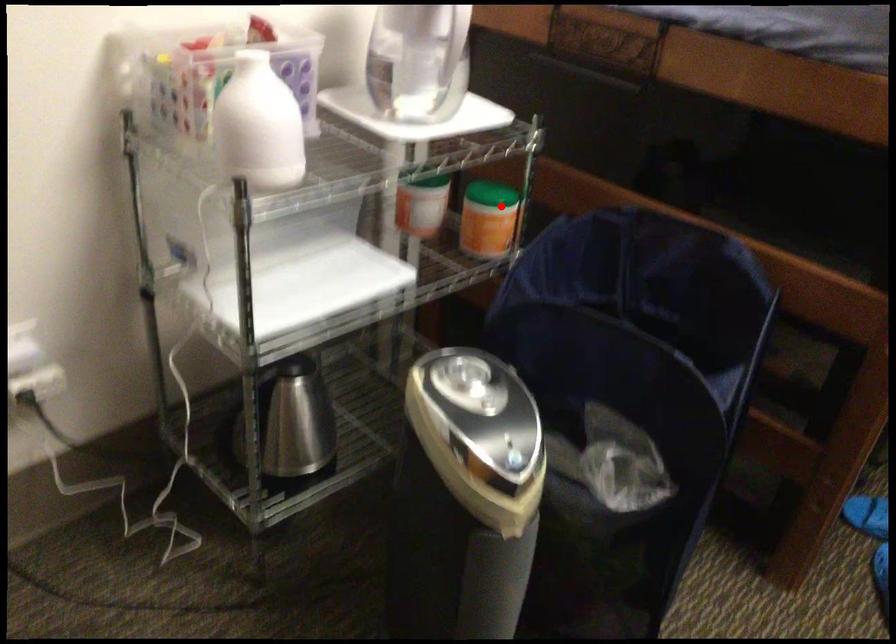
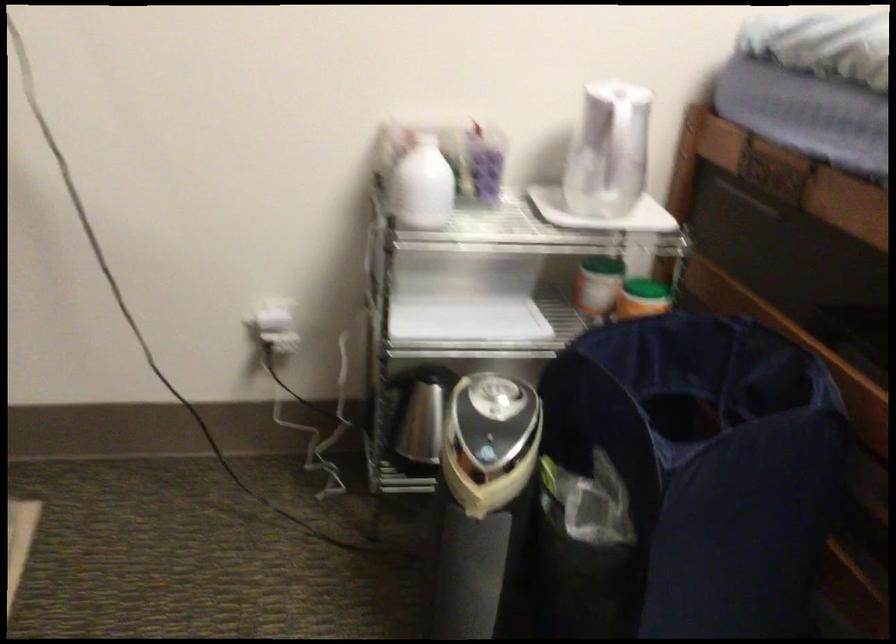
Find the pixel in the second image that matches the highlighted location in the first image.

(642, 298)